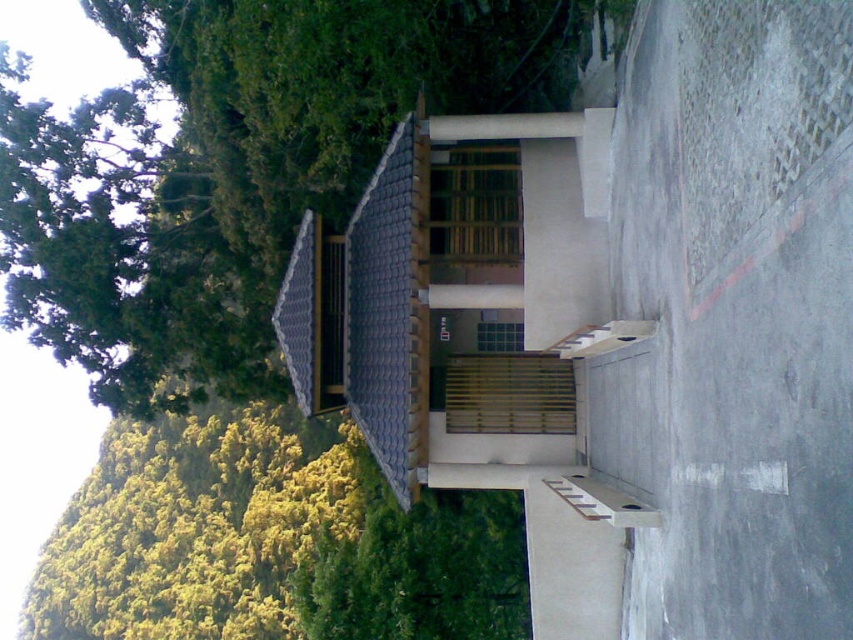
Is green leafy tree at upper left shorter than wooden stairs at lower center?

Incorrect, green leafy tree at upper left's height does not fall short of wooden stairs at lower center's.

Can you confirm if green leafy tree at upper left is taller than wooden stairs at lower center?

Yes, green leafy tree at upper left is taller than wooden stairs at lower center.

Is point (131, 129) more distant than point (589, 515)?

That is True.

Where is `green leafy tree at upper left`? The height and width of the screenshot is (640, 853). green leafy tree at upper left is located at coordinates (236, 166).